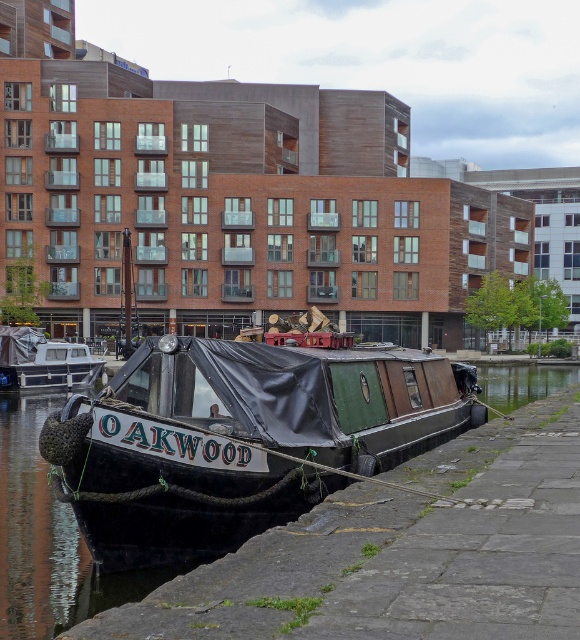
Does point (303, 499) come closer to viewer compared to point (38, 348)?

Yes, it is in front of point (38, 348).

Is black polished wood boat at center further to camera compared to matte black boat at left?

No, it is in front of matte black boat at left.

Between point (375, 348) and point (42, 385), which one is positioned in front?

Positioned in front is point (375, 348).

Where is `black polished wood boat at center`? The width and height of the screenshot is (580, 640). black polished wood boat at center is located at coordinates (241, 438).